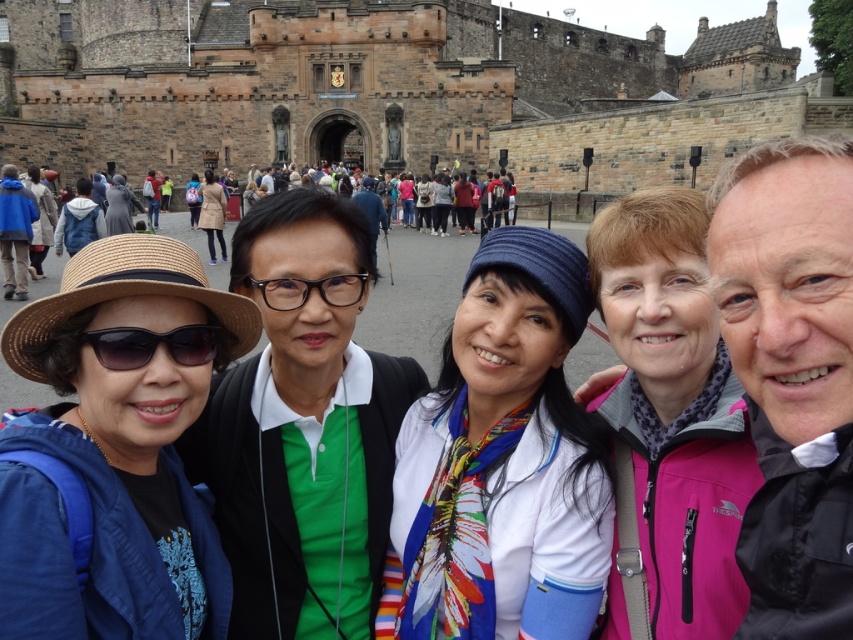
In the scene shown: You are a photographer standing at the location of the sunglasses at left and want to take a picture of the transparent plastic glasses at center. If your camera has a maximum focus range of 10 meters, will it be able to capture the glasses clearly?

The distance between sunglasses at left and transparent plastic glasses at center is 9.28 meters, which is within the camera maximum focus range of 10 meters. So yes, the camera can capture the glasses clearly.

You are a photographer trying to capture a clear shot of the sunglasses at left and transparent plastic glasses at center. Which object has a narrower frame?

The sunglasses at left has a narrower frame than the transparent plastic glasses at center.